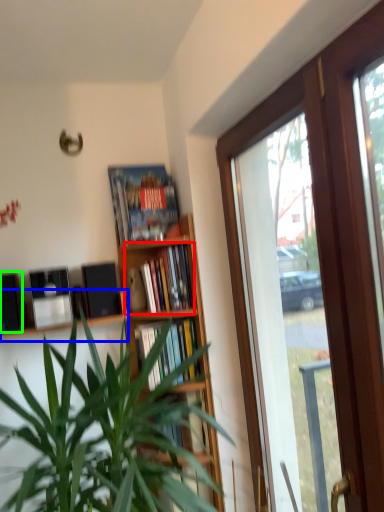
Question: Which object is the closest to the book (highlighted by a red box)? Choose among these: shelf (highlighted by a blue box) or loudspeaker (highlighted by a green box).

Choices:
 (A) shelf
 (B) loudspeaker

Answer: (A)